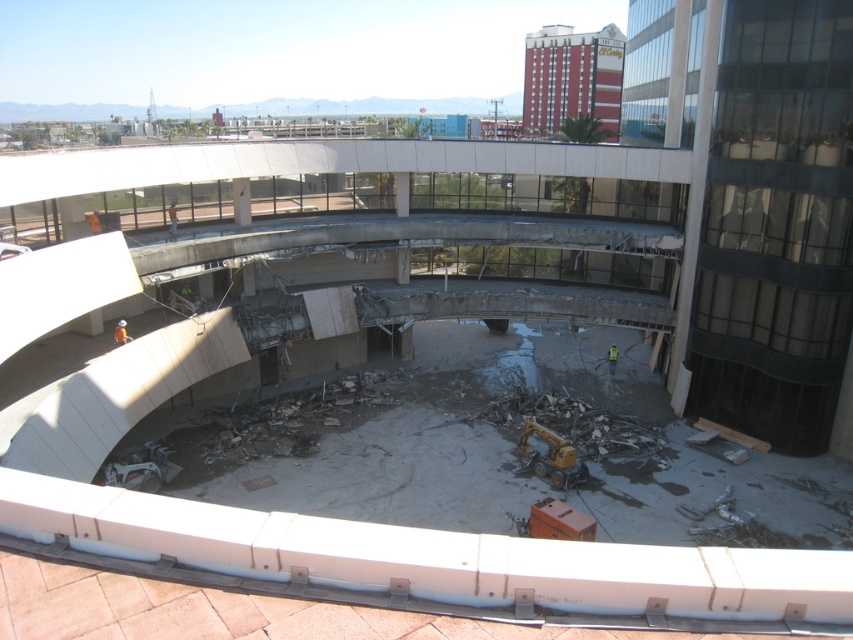
Find the location of a particular element. The image size is (853, 640). orange safety vest at lower center is located at coordinates (120, 332).

Does orange safety vest at lower center have a greater height compared to green reflective safety vest at lower center?

No.

Describe the element at coordinates (120, 332) in the screenshot. I see `orange safety vest at lower center` at that location.

The width and height of the screenshot is (853, 640). I want to click on orange safety vest at lower center, so click(x=120, y=332).